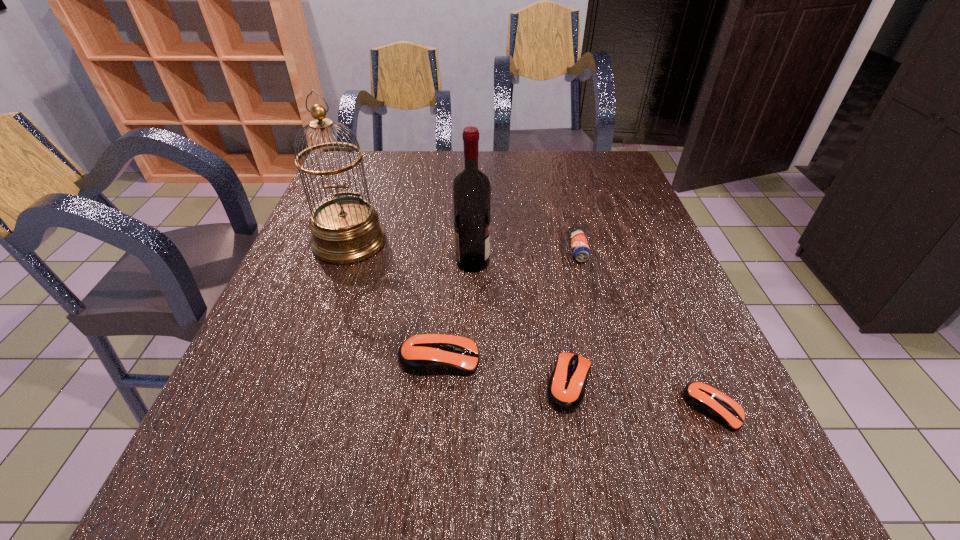
The width and height of the screenshot is (960, 540). In order to click on vacant area at the right edge of the desktop in this screenshot , I will do coord(604,201).

In the image, there is a desktop. Where is `free space at the near left corner`? free space at the near left corner is located at coordinates (233, 401).

Where is `vacant area that lies between the birdcage and the alcohol`? vacant area that lies between the birdcage and the alcohol is located at coordinates (411, 252).

This screenshot has width=960, height=540. I want to click on free space between the shortest computer mouse and the fourth object from left to right, so click(641, 396).

The image size is (960, 540). Identify the location of blank region between the rightmost computer mouse and the alcohol. (593, 335).

The width and height of the screenshot is (960, 540). In order to click on vacant space that is in between the rightmost object and the second computer mouse from left to right in this screenshot , I will do `click(641, 396)`.

Identify the location of vacant space that is in between the beer can and the second computer mouse from right to left. (573, 316).

Identify the location of vacant region between the alcohol and the birdcage. This screenshot has height=540, width=960. (411, 252).

Locate an element on the screen. The width and height of the screenshot is (960, 540). free point between the second shortest object and the leftmost computer mouse is located at coordinates (504, 371).

Where is `object that is the second nearest to the second tallest computer mouse`? This screenshot has width=960, height=540. object that is the second nearest to the second tallest computer mouse is located at coordinates (705, 399).